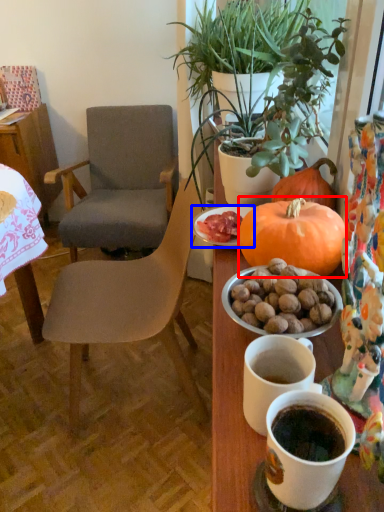
Question: Which point is further to the camera, pumpkin (highlighted by a red box) or plate (highlighted by a blue box)?

Choices:
 (A) pumpkin
 (B) plate

Answer: (B)